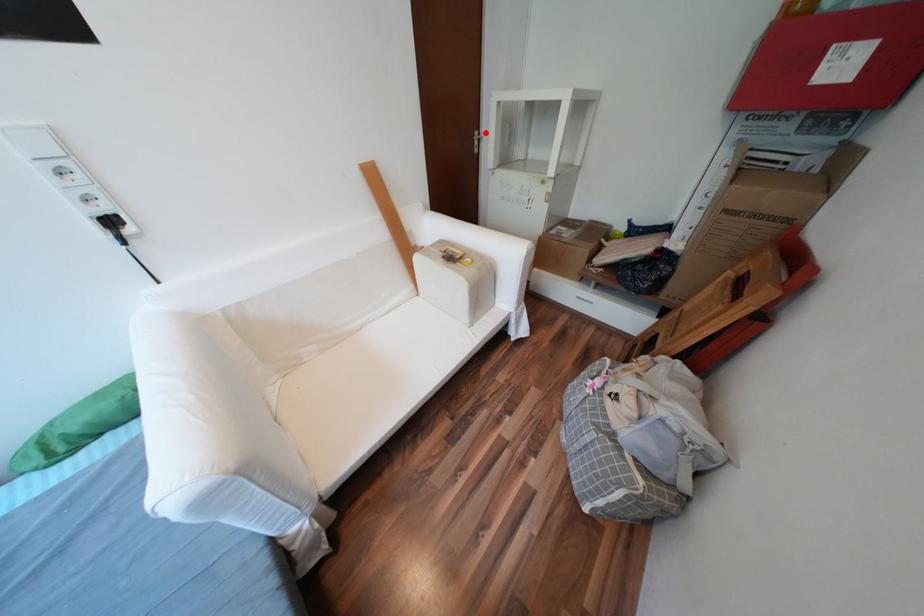
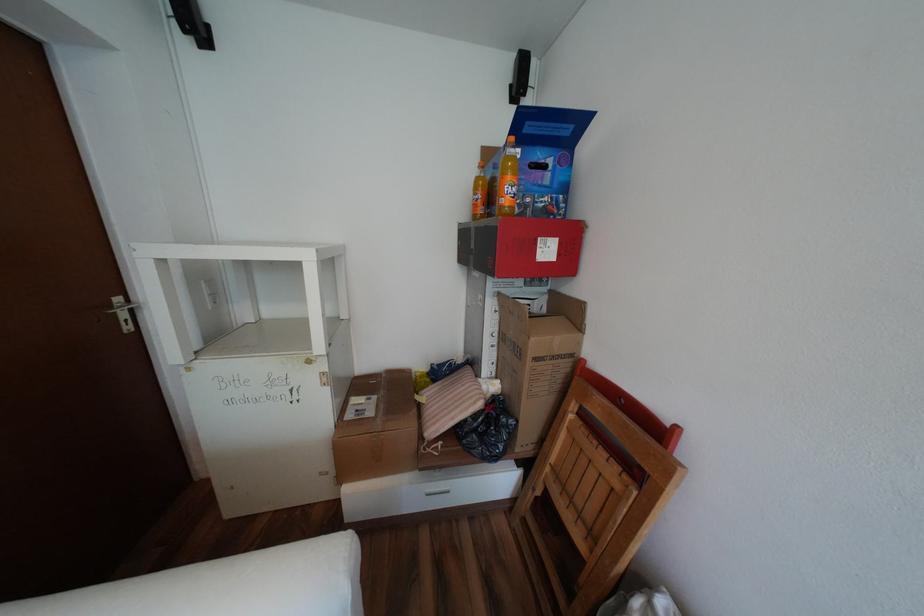
Question: I am providing you with two images of the same scene from different viewpoints. In image1, a red point is highlighted. Considering the same 3D point in image2, which of the following is correct?

Choices:
 (A) It is closer
 (B) It is farther

Answer: (B)